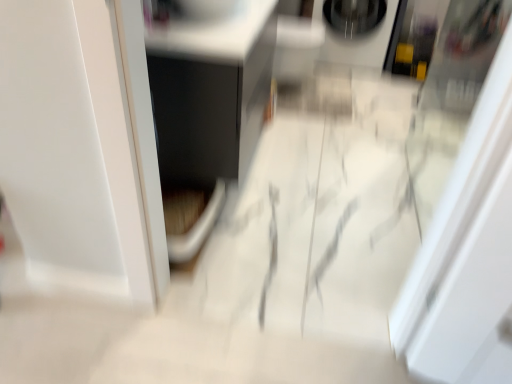
Image resolution: width=512 pixels, height=384 pixels. What do you see at coordinates (209, 84) in the screenshot?
I see `white glossy countertop at center` at bounding box center [209, 84].

Measure the distance between white glossy countertop at center and camera.

1.45 meters.

At what (x,y) coordinates should I click in order to perform the action: click on white glossy countertop at center. Please return your answer as a coordinate pair (x, y). The image size is (512, 384). Looking at the image, I should click on (209, 84).

Identify the location of white glossy countertop at center. (209, 84).